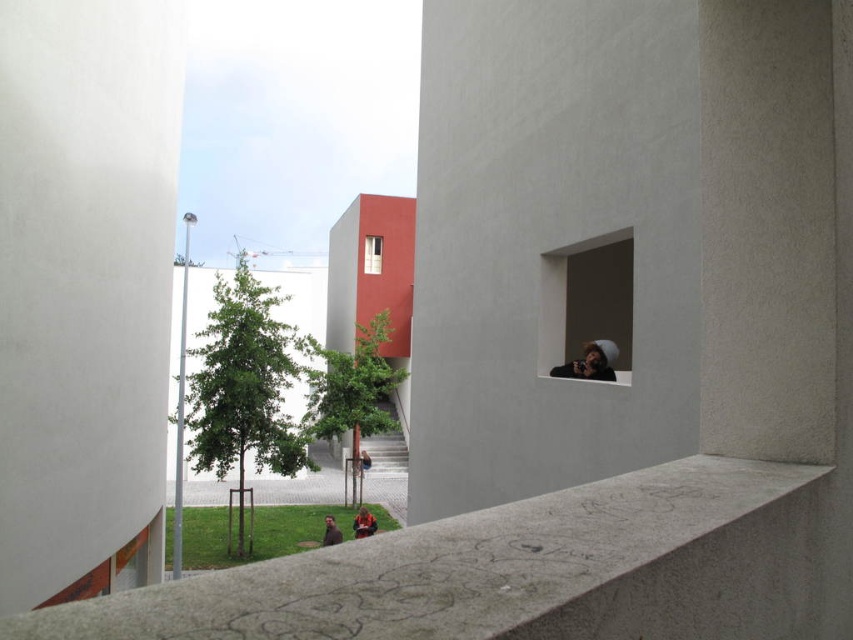
Question: Does concrete ledge at lower center appear under brown leather jacket at lower center?

Choices:
 (A) no
 (B) yes

Answer: (A)

Question: Which object appears farthest from the camera in this image?

Choices:
 (A) matte gray window at upper right
 (B) brown leather jacket at lower center

Answer: (B)

Question: Which point is closer to the camera taking this photo?

Choices:
 (A) (323, 545)
 (B) (364, 248)
 (C) (352, 518)

Answer: (A)

Question: Is matte glass window at center below green fabric jacket at lower center?

Choices:
 (A) no
 (B) yes

Answer: (A)

Question: Which object is closer to the camera taking this photo?

Choices:
 (A) brown leather jacket at lower center
 (B) matte glass window at center

Answer: (A)

Question: Does concrete ledge at lower center appear under brown leather jacket at lower center?

Choices:
 (A) no
 (B) yes

Answer: (A)